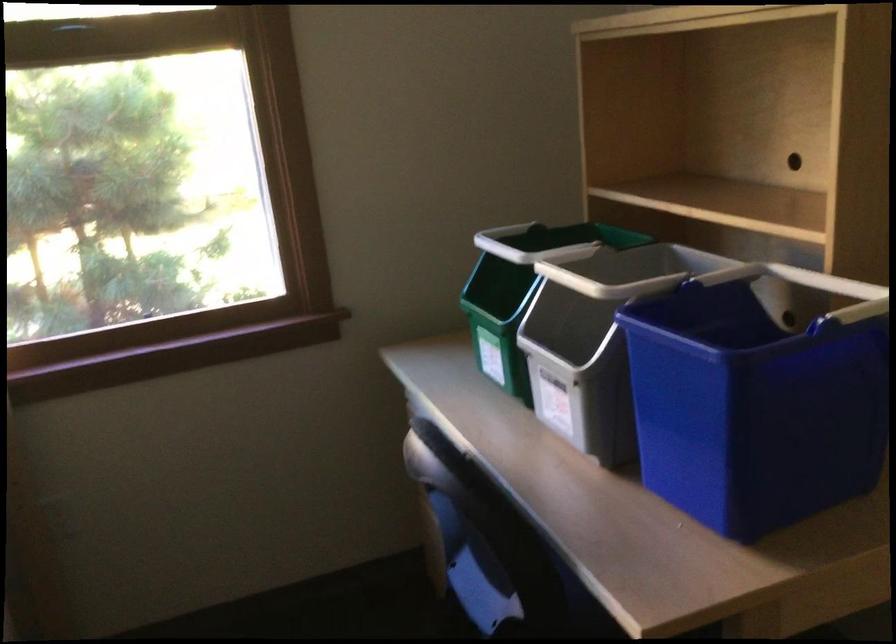
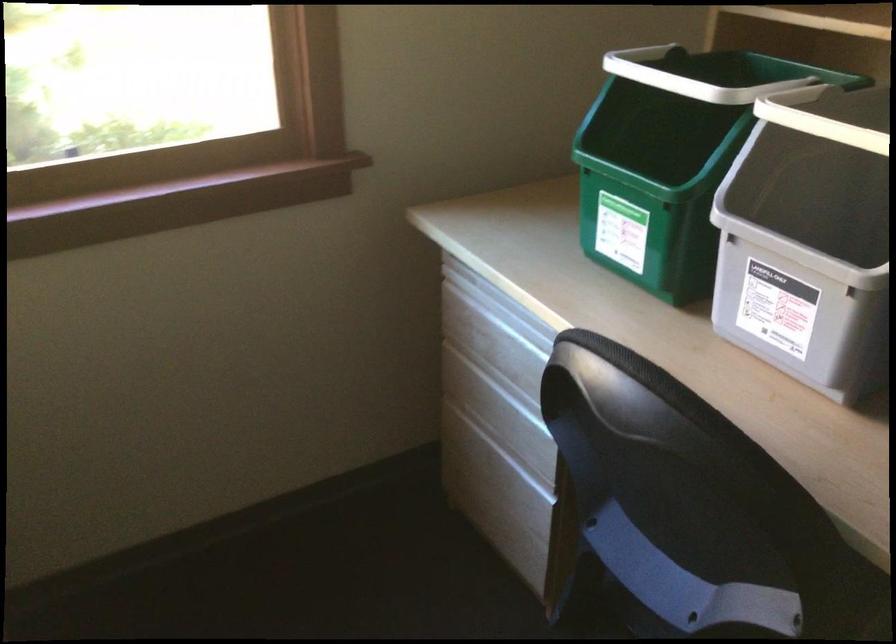
In the second image, find the point that corresponds to point 553,361 in the first image.

(797, 250)